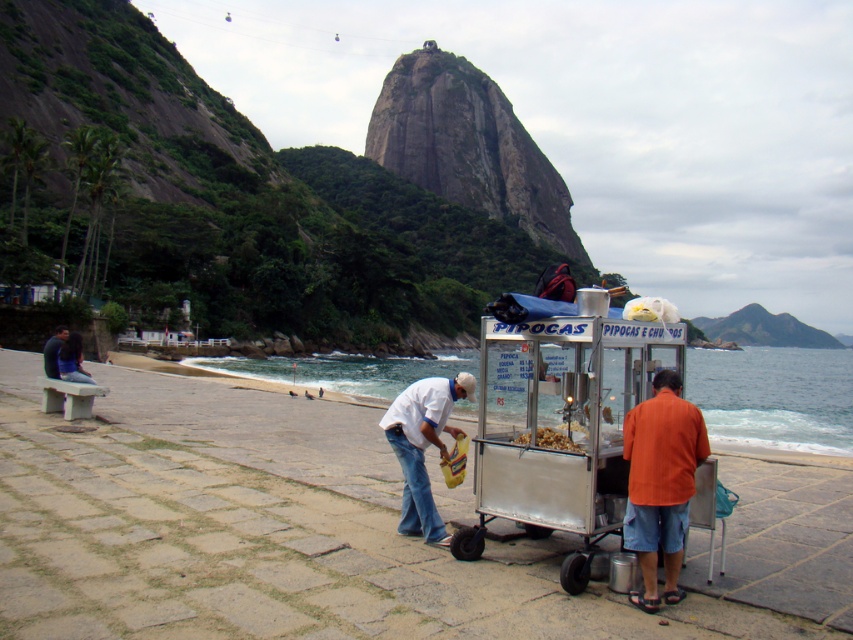
Looking at this image, is orange linen shirt at lower right wider than white matte shirt at center?

In fact, orange linen shirt at lower right might be narrower than white matte shirt at center.

Can you confirm if orange linen shirt at lower right is positioned to the right of white matte shirt at center?

Yes, orange linen shirt at lower right is to the right of white matte shirt at center.

At what (x,y) coordinates should I click in order to perform the action: click on orange linen shirt at lower right. Please return your answer as a coordinate pair (x, y). This screenshot has height=640, width=853. Looking at the image, I should click on (660, 483).

You are a GUI agent. You are given a task and a screenshot of the screen. Output one action in this format:
    pyautogui.click(x=<x>, y=<y>)
    Task: Click on the orange linen shirt at lower right
    This screenshot has width=853, height=640.
    Given the screenshot: What is the action you would take?
    pyautogui.click(x=660, y=483)

Is point (329, 472) farther from viewer compared to point (592, 360)?

Yes.

Is point (463, 497) closer to camera compared to point (526, 401)?

No, it is not.

Image resolution: width=853 pixels, height=640 pixels. Identify the location of smooth sand at lower center. (291, 532).

Locate an element on the screen. The height and width of the screenshot is (640, 853). smooth sand at lower center is located at coordinates (291, 532).

Does smooth sand at lower center have a greater height compared to orange linen shirt at lower right?

In fact, smooth sand at lower center may be shorter than orange linen shirt at lower right.

Which is in front, point (206, 604) or point (665, 419)?

Positioned in front is point (206, 604).

Find the location of a particular element. The height and width of the screenshot is (640, 853). smooth sand at lower center is located at coordinates (291, 532).